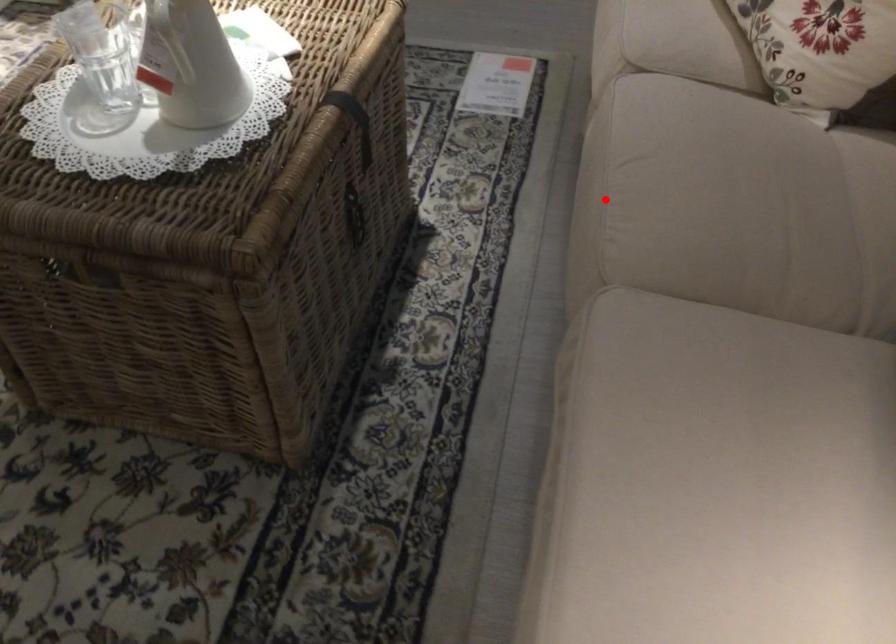
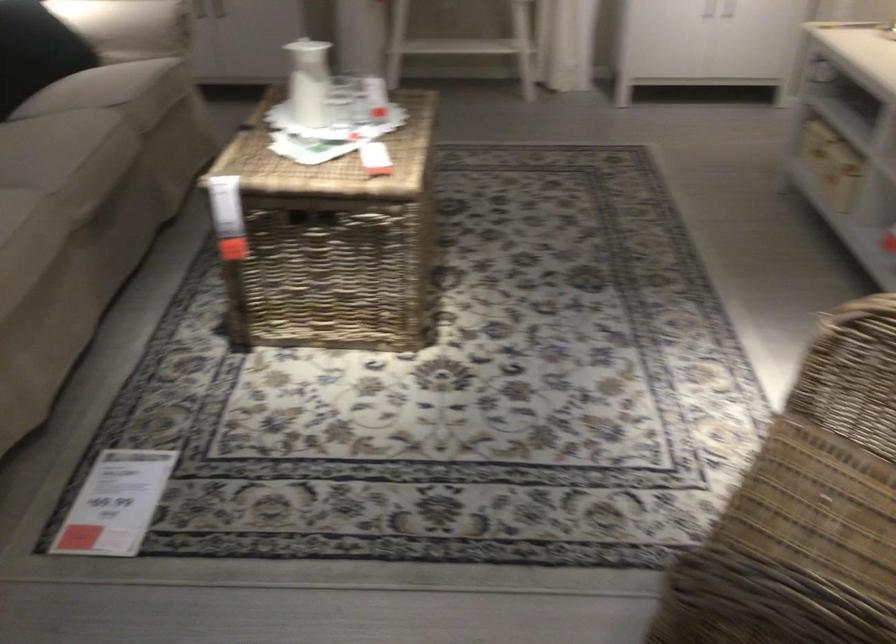
Locate, in the second image, the point that corresponds to the highlighted location in the first image.

(109, 140)